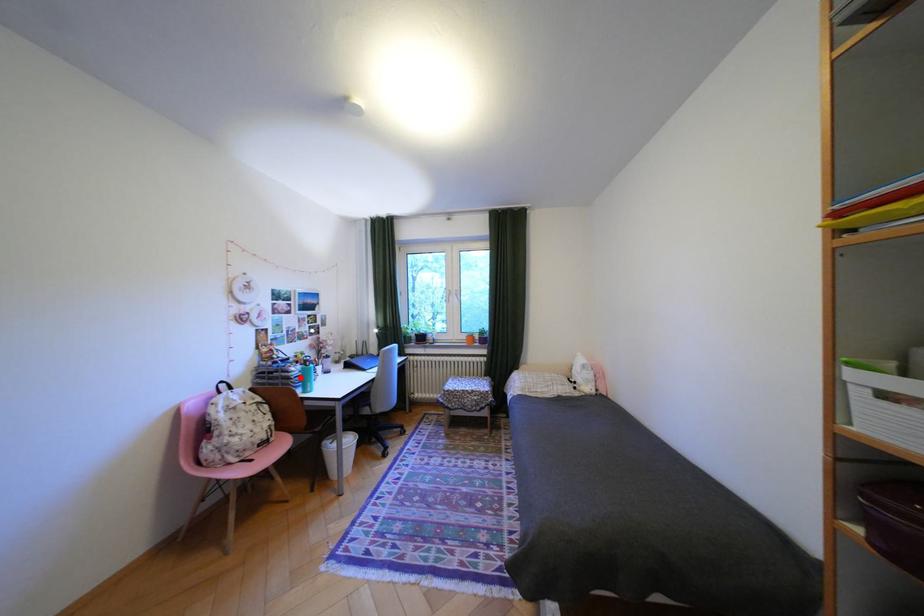
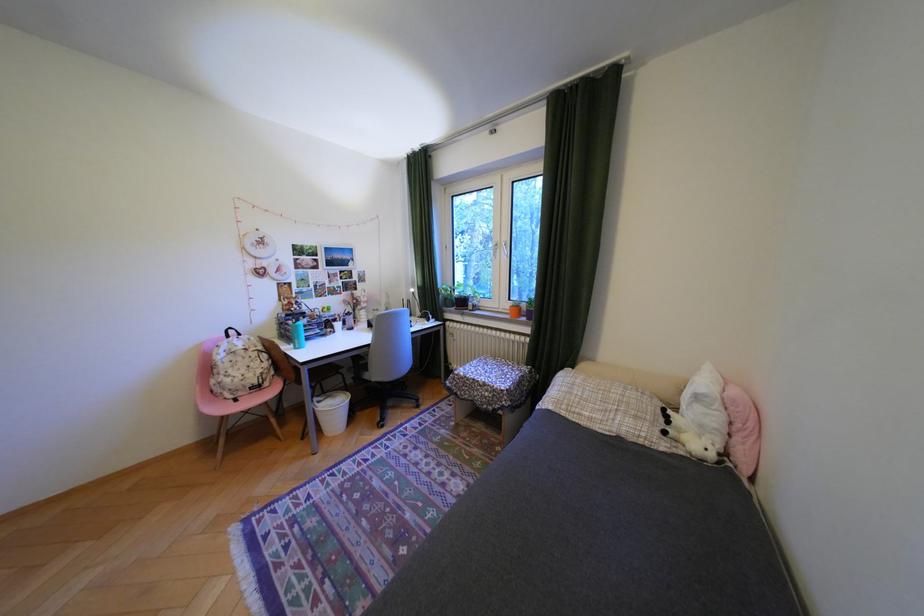
Locate, in the second image, the point that corresponds to the highlighted location in the first image.

(300, 331)